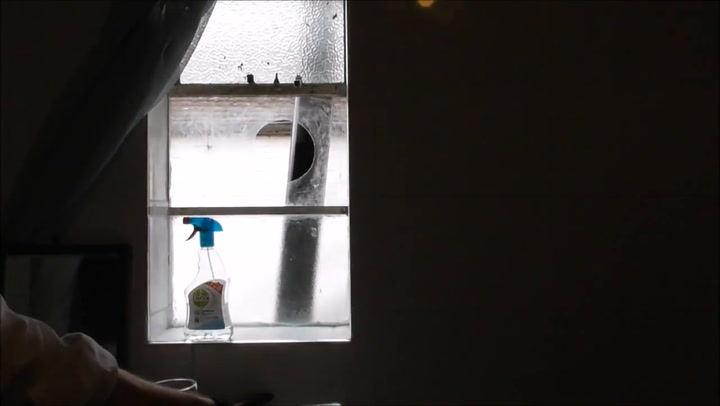
Where is `window sill lock`? The width and height of the screenshot is (720, 406). window sill lock is located at coordinates (276, 78).